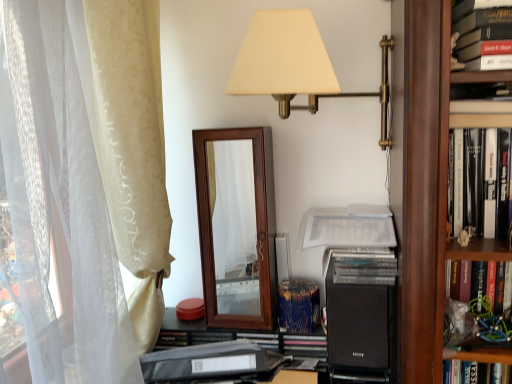
Question: Is hardcover book at right, which is the first book from back to front, smaller than hardcover book at upper right, placed as the first book when sorted from top to bottom?

Choices:
 (A) yes
 (B) no

Answer: (A)

Question: Is hardcover book at right, marked as the second book in a front-to-back arrangement, taller than hardcover book at upper right, marked as the first book in a front-to-back arrangement?

Choices:
 (A) yes
 (B) no

Answer: (B)

Question: Can you confirm if hardcover book at right, marked as the second book in a front-to-back arrangement, is positioned to the right of hardcover book at upper right, the second book in the bottom-to-top sequence?

Choices:
 (A) yes
 (B) no

Answer: (A)

Question: Does hardcover book at right, the second book when ordered from top to bottom, have a larger size compared to hardcover book at upper right, the 2th book viewed from the back?

Choices:
 (A) yes
 (B) no

Answer: (B)

Question: From a real-world perspective, is hardcover book at right, which is the first book from back to front, positioned over hardcover book at upper right, placed as the first book when sorted from top to bottom, based on gravity?

Choices:
 (A) no
 (B) yes

Answer: (A)

Question: In the image, is hardcover book at upper right, marked as the first book in a front-to-back arrangement, positioned in front of or behind beige satin curtain at left?

Choices:
 (A) behind
 (B) front

Answer: (B)

Question: Based on their sizes in the image, would you say hardcover book at upper right, placed as the first book when sorted from top to bottom, is bigger or smaller than beige satin curtain at left?

Choices:
 (A) big
 (B) small

Answer: (B)

Question: Considering the positions of point (509, 43) and point (29, 198), is point (509, 43) closer or farther from the camera than point (29, 198)?

Choices:
 (A) closer
 (B) farther

Answer: (A)

Question: Considering the relative positions of hardcover book at upper right, marked as the first book in a front-to-back arrangement, and beige satin curtain at left in the image provided, is hardcover book at upper right, marked as the first book in a front-to-back arrangement, to the left or to the right of beige satin curtain at left?

Choices:
 (A) left
 (B) right

Answer: (B)

Question: In terms of height, does black plastic folder at lower center look taller or shorter compared to matte gold lamp at upper center?

Choices:
 (A) tall
 (B) short

Answer: (B)

Question: Is point (226, 334) positioned closer to the camera than point (308, 94)?

Choices:
 (A) farther
 (B) closer

Answer: (A)

Question: In terms of width, does black plastic folder at lower center look wider or thinner when compared to matte gold lamp at upper center?

Choices:
 (A) wide
 (B) thin

Answer: (B)

Question: Would you say black plastic folder at lower center is to the left or to the right of matte gold lamp at upper center in the picture?

Choices:
 (A) right
 (B) left

Answer: (B)

Question: Considering the positions of hardcover book at right, which is the first book from back to front, and black matte speaker at center in the image, is hardcover book at right, which is the first book from back to front, taller or shorter than black matte speaker at center?

Choices:
 (A) tall
 (B) short

Answer: (B)

Question: Considering the positions of hardcover book at right, which is counted as the 1th book, starting from the bottom, and black matte speaker at center in the image, is hardcover book at right, which is counted as the 1th book, starting from the bottom, wider or thinner than black matte speaker at center?

Choices:
 (A) thin
 (B) wide

Answer: (B)